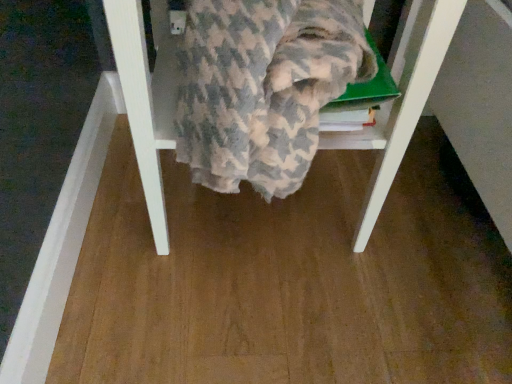
I want to click on free space in front of textured fabric blanket at center, so click(x=256, y=321).